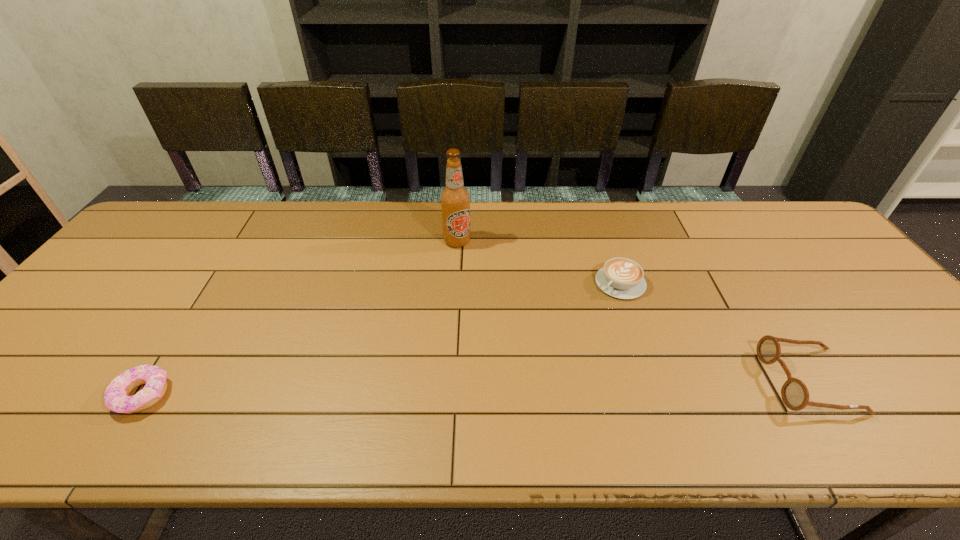
Find the location of a particular element. This screenshot has width=960, height=540. vacant area at the far edge of the desktop is located at coordinates (496, 218).

In the image, there is a desktop. Find the location of `vacant space at the near edge`. vacant space at the near edge is located at coordinates (598, 400).

Identify the location of vacant area that lies between the second tallest object and the farthest object. (634, 311).

Locate an element on the screen. The image size is (960, 540). vacant region between the beer bottle and the third object from left to right is located at coordinates (539, 262).

At what (x,y) coordinates should I click in order to perform the action: click on vacant space that is in between the doughnut and the beer bottle. Please return your answer as a coordinate pair (x, y). The width and height of the screenshot is (960, 540). Looking at the image, I should click on (300, 318).

The image size is (960, 540). In order to click on unoccupied area between the beer bottle and the leftmost object in this screenshot , I will do `click(300, 318)`.

Locate an element on the screen. free spot between the leftmost object and the tallest object is located at coordinates (300, 318).

This screenshot has width=960, height=540. I want to click on free space between the doughnut and the tallest object, so click(x=300, y=318).

Identify the location of free spot between the doughnut and the cappuccino. The width and height of the screenshot is (960, 540). (381, 339).

Locate an element on the screen. This screenshot has height=540, width=960. free area in between the second object from left to right and the rightmost object is located at coordinates (634, 311).